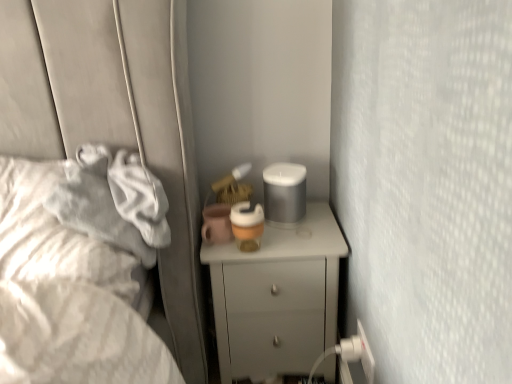
Question: Is white plastic electric outlet at lower right not close to white glossy chest of drawers at center?

Choices:
 (A) no
 (B) yes

Answer: (A)

Question: Does white plastic electric outlet at lower right lie behind white glossy chest of drawers at center?

Choices:
 (A) no
 (B) yes

Answer: (A)

Question: From a real-world perspective, is white plastic electric outlet at lower right located beneath white glossy chest of drawers at center?

Choices:
 (A) no
 (B) yes

Answer: (A)

Question: Is white plastic electric outlet at lower right aimed at white glossy chest of drawers at center?

Choices:
 (A) yes
 (B) no

Answer: (B)

Question: Is white plastic electric outlet at lower right to the left of white glossy chest of drawers at center from the viewer's perspective?

Choices:
 (A) yes
 (B) no

Answer: (B)

Question: From their relative heights in the image, would you say white plastic electric outlet at lower right is taller or shorter than white glossy chest of drawers at center?

Choices:
 (A) tall
 (B) short

Answer: (B)

Question: Relative to white glossy chest of drawers at center, is white plastic electric outlet at lower right in front or behind?

Choices:
 (A) front
 (B) behind

Answer: (A)

Question: Is white plastic electric outlet at lower right wider or thinner than white glossy chest of drawers at center?

Choices:
 (A) wide
 (B) thin

Answer: (B)

Question: Considering the positions of white plastic electric outlet at lower right and white glossy chest of drawers at center in the image, is white plastic electric outlet at lower right bigger or smaller than white glossy chest of drawers at center?

Choices:
 (A) big
 (B) small

Answer: (B)

Question: From the image's perspective, is white soft fabric at left located above or below white glossy chest of drawers at center?

Choices:
 (A) below
 (B) above

Answer: (B)

Question: In terms of width, does white soft fabric at left look wider or thinner when compared to white glossy chest of drawers at center?

Choices:
 (A) thin
 (B) wide

Answer: (B)

Question: From a real-world perspective, relative to white glossy chest of drawers at center, is white soft fabric at left vertically above or below?

Choices:
 (A) above
 (B) below

Answer: (A)

Question: Is white soft fabric at left to the left or to the right of white glossy chest of drawers at center in the image?

Choices:
 (A) right
 (B) left

Answer: (B)

Question: In terms of width, does white soft fabric at left look wider or thinner when compared to white plastic electric outlet at lower right?

Choices:
 (A) thin
 (B) wide

Answer: (B)

Question: Relative to white plastic electric outlet at lower right, is white soft fabric at left in front or behind?

Choices:
 (A) behind
 (B) front

Answer: (B)